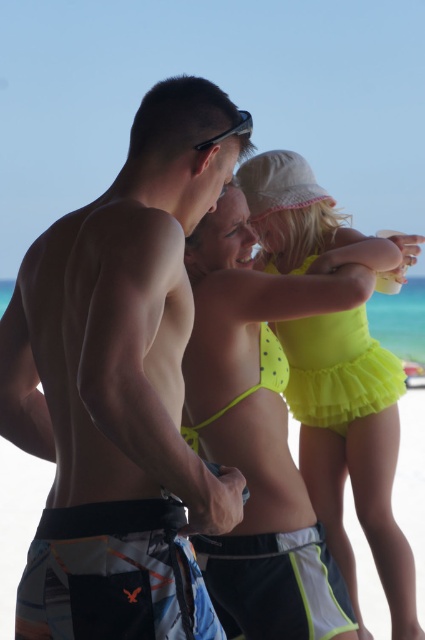
From the picture: In the beach scene, there are two men and one woman. The man on the left has colorful orange and white swim trunks, while the central man has simpler black swim trunks. A point is marked at coordinates (113,576). Which man is wearing the printed fabric boardshorts indicated by this point?

The point at (113,576) marks the printed fabric boardshorts at lower left, which belong to the man on the left who has colorful orange and white swim trunks.

You are a photographer trying to capture a candid shot of the neon yellow swimsuit at center and the matte black goggles at upper center. Which object should you focus on first if you want to ensure both are in the frame without moving the camera?

The matte black goggles at upper center should be focused on first since the neon yellow swimsuit at center is located below it, ensuring the goggles remain in the frame while adjusting the focus downward.